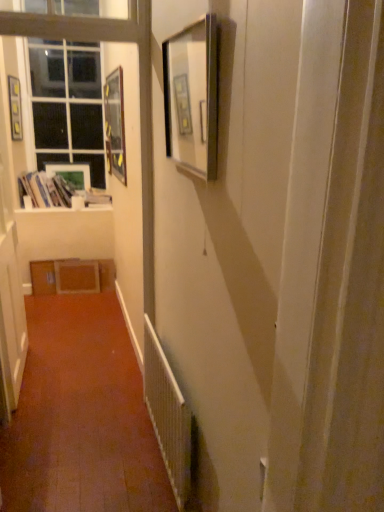
Question: From a real-world perspective, is white paper stack at left beneath matte wooden picture frame at upper left, marked as the 2th picture frame in a front-to-back arrangement?

Choices:
 (A) yes
 (B) no

Answer: (A)

Question: Is white paper stack at left looking in the opposite direction of matte wooden picture frame at upper left, the third picture frame positioned from the left?

Choices:
 (A) no
 (B) yes

Answer: (A)

Question: Considering the relative sizes of white paper stack at left and matte wooden picture frame at upper left, which ranks as the second picture frame in right-to-left order, in the image provided, is white paper stack at left wider than matte wooden picture frame at upper left, which ranks as the second picture frame in right-to-left order,?

Choices:
 (A) yes
 (B) no

Answer: (A)

Question: From the image's perspective, is white paper stack at left located above matte wooden picture frame at upper left, marked as the 2th picture frame in a front-to-back arrangement?

Choices:
 (A) yes
 (B) no

Answer: (B)

Question: From a real-world perspective, is white paper stack at left on top of matte wooden picture frame at upper left, positioned as the 3th picture frame in back-to-front order?

Choices:
 (A) no
 (B) yes

Answer: (A)

Question: Considering the positions of matte wooden picture frame at upper left, the 2th picture frame viewed from the left, and white glossy window sill at upper left in the image, is matte wooden picture frame at upper left, the 2th picture frame viewed from the left, wider or thinner than white glossy window sill at upper left?

Choices:
 (A) wide
 (B) thin

Answer: (B)

Question: In terms of height, does matte wooden picture frame at upper left, placed as the first picture frame when sorted from back to front, look taller or shorter compared to white glossy window sill at upper left?

Choices:
 (A) tall
 (B) short

Answer: (A)

Question: Is matte wooden picture frame at upper left, which is the fourth picture frame from front to back, in front of or behind white glossy window sill at upper left in the image?

Choices:
 (A) behind
 (B) front

Answer: (A)

Question: Based on their positions, is matte wooden picture frame at upper left, placed as the first picture frame when sorted from back to front, located to the left or right of white glossy window sill at upper left?

Choices:
 (A) left
 (B) right

Answer: (A)

Question: From the image's perspective, is clear glass window at upper left above or below matte black picture frame at upper center, arranged as the first picture frame when viewed from the right?

Choices:
 (A) above
 (B) below

Answer: (A)

Question: In terms of width, does clear glass window at upper left look wider or thinner when compared to matte black picture frame at upper center, which is the first picture frame from front to back?

Choices:
 (A) wide
 (B) thin

Answer: (A)

Question: From a real-world perspective, is clear glass window at upper left physically located above or below matte black picture frame at upper center, arranged as the first picture frame when viewed from the right?

Choices:
 (A) below
 (B) above

Answer: (A)

Question: Is clear glass window at upper left taller or shorter than matte black picture frame at upper center, which is the first picture frame from front to back?

Choices:
 (A) tall
 (B) short

Answer: (A)

Question: From the image's perspective, is white glossy window sill at upper left above or below white matte door at left?

Choices:
 (A) above
 (B) below

Answer: (A)

Question: Considering their positions, is white glossy window sill at upper left located in front of or behind white matte door at left?

Choices:
 (A) behind
 (B) front

Answer: (A)